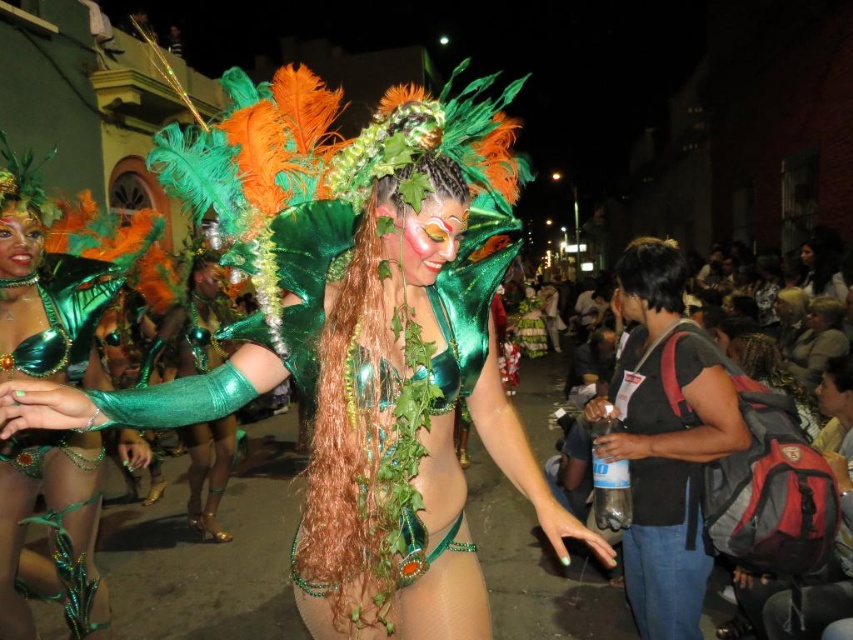
Does green velvet bikini at center appear on the left side of black matte backpack at right?

Yes, green velvet bikini at center is to the left of black matte backpack at right.

Which is behind, point (310, 509) or point (697, 531)?

Positioned behind is point (697, 531).

Where is `green velvet bikini at center`? The width and height of the screenshot is (853, 640). green velvet bikini at center is located at coordinates (355, 337).

Is green velvet bikini at center further to camera compared to green sequined bikini top at center?

No.

Can you confirm if green velvet bikini at center is positioned above green sequined bikini top at center?

Yes, green velvet bikini at center is above green sequined bikini top at center.

The height and width of the screenshot is (640, 853). What do you see at coordinates (355, 337) in the screenshot?
I see `green velvet bikini at center` at bounding box center [355, 337].

Where is `green velvet bikini at center`? green velvet bikini at center is located at coordinates (355, 337).

Who is positioned more to the right, green sequined bikini top at center or black matte backpack at right?

From the viewer's perspective, black matte backpack at right appears more on the right side.

Does green sequined bikini top at center appear on the left side of black matte backpack at right?

Yes, green sequined bikini top at center is to the left of black matte backpack at right.

This screenshot has width=853, height=640. What do you see at coordinates (45, 292) in the screenshot?
I see `green sequined bikini top at center` at bounding box center [45, 292].

Locate an element on the screen. green sequined bikini top at center is located at coordinates pos(45,292).